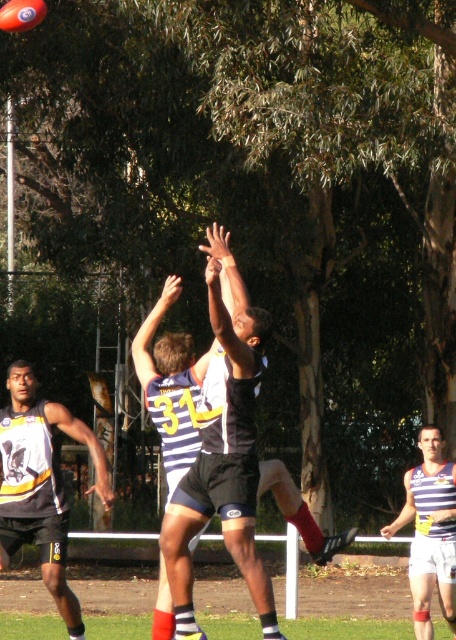
Question: Does yellow and black jersey at center appear on the left side of striped jersey at center?

Choices:
 (A) no
 (B) yes

Answer: (B)

Question: Which object is farther from the camera taking this photo?

Choices:
 (A) black jersey at center
 (B) yellow and black jersey at center

Answer: (B)

Question: Where is yellow and black jersey at center located in relation to striped jersey at center in the image?

Choices:
 (A) above
 (B) below

Answer: (A)

Question: Does yellow and black jersey at center have a greater width compared to striped jersey at center?

Choices:
 (A) yes
 (B) no

Answer: (A)

Question: Which object is positioned farthest from the striped jersey at center?

Choices:
 (A) yellow and black jersey at center
 (B) black jersey at center

Answer: (B)

Question: Which of the following is the farthest from the observer?

Choices:
 (A) black jersey at center
 (B) striped jersey at center
 (C) yellow and black jersey at center

Answer: (B)